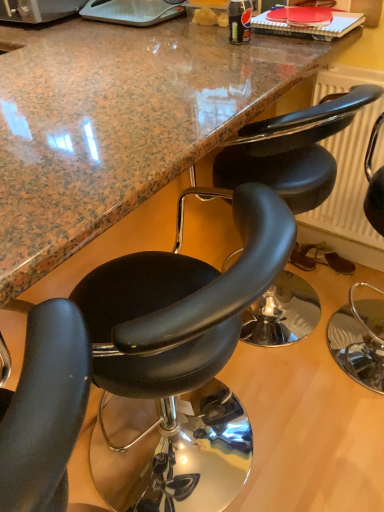
Question: From the image's perspective, is marble countertop at center below black leather chair at center, the 2th chair in the right-to-left sequence?

Choices:
 (A) yes
 (B) no

Answer: (B)

Question: Is marble countertop at center looking in the opposite direction of black leather chair at center, the 2th chair in the right-to-left sequence?

Choices:
 (A) no
 (B) yes

Answer: (B)

Question: Considering the relative positions of marble countertop at center and black leather chair at center, the 2th chair in the right-to-left sequence, in the image provided, is marble countertop at center to the left of black leather chair at center, the 2th chair in the right-to-left sequence, from the viewer's perspective?

Choices:
 (A) yes
 (B) no

Answer: (A)

Question: Could you tell me if marble countertop at center is facing black leather chair at center, the 2th chair viewed from the left?

Choices:
 (A) yes
 (B) no

Answer: (A)

Question: Is black leather chair at center, the 2th chair viewed from the left, completely or partially inside marble countertop at center?

Choices:
 (A) yes
 (B) no

Answer: (A)

Question: From the image's perspective, relative to marble countertop at center, is black leather chair at right, which appears as the third chair when viewed from the left, above or below?

Choices:
 (A) above
 (B) below

Answer: (B)

Question: Relative to marble countertop at center, is black leather chair at right, which is the 1th chair in right-to-left order, in front or behind?

Choices:
 (A) front
 (B) behind

Answer: (B)

Question: Is black leather chair at right, which is the 1th chair in right-to-left order, to the left or to the right of marble countertop at center in the image?

Choices:
 (A) left
 (B) right

Answer: (B)

Question: Considering the positions of point (334, 343) and point (66, 27), is point (334, 343) closer or farther from the camera than point (66, 27)?

Choices:
 (A) closer
 (B) farther

Answer: (A)

Question: Considering the positions of point (9, 100) and point (119, 506), is point (9, 100) closer or farther from the camera than point (119, 506)?

Choices:
 (A) farther
 (B) closer

Answer: (B)

Question: Which is correct: marble countertop at center is inside black leather chair at center, arranged as the 1th chair when viewed from the left, or outside of it?

Choices:
 (A) outside
 (B) inside

Answer: (A)

Question: From the image's perspective, is marble countertop at center above or below black leather chair at center, arranged as the 1th chair when viewed from the left?

Choices:
 (A) above
 (B) below

Answer: (A)

Question: Looking at the image, does marble countertop at center seem bigger or smaller compared to black leather chair at center, the 3th chair viewed from the right?

Choices:
 (A) big
 (B) small

Answer: (A)

Question: Based on their positions, is black leather chair at center, the 2th chair in the right-to-left sequence, located to the left or right of marble countertop at center?

Choices:
 (A) right
 (B) left

Answer: (A)

Question: Is point (271, 163) closer or farther from the camera than point (54, 228)?

Choices:
 (A) farther
 (B) closer

Answer: (A)